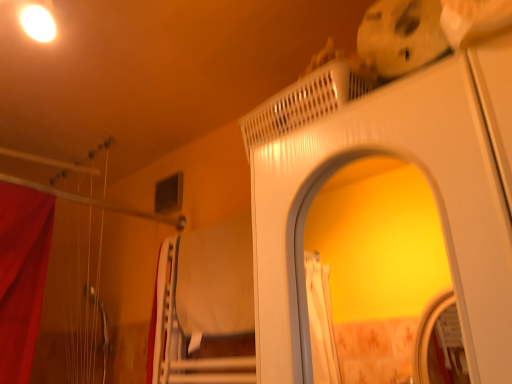
Question: Relative to white glossy screen door at upper center, is white textured bed at center in front or behind?

Choices:
 (A) front
 (B) behind

Answer: (B)

Question: From a real-world perspective, is white textured bed at center above or below white glossy screen door at upper center?

Choices:
 (A) below
 (B) above

Answer: (B)

Question: Which of these objects is positioned closest to the white textured bed at center?

Choices:
 (A) white glossy screen door at upper center
 (B) white fabric curtain at lower left

Answer: (B)

Question: Estimate the real-world distances between objects in this image. Which object is farther from the white glossy screen door at upper center?

Choices:
 (A) white textured bed at center
 (B) white fabric curtain at lower left

Answer: (B)